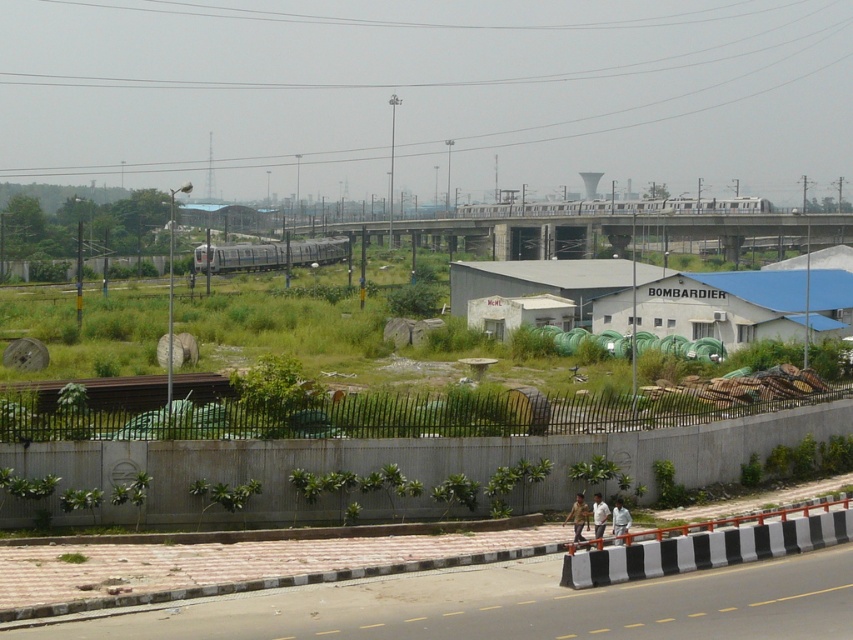
Consider the image. You are a delivery person carrying a package and need to cross from the brown metallic train track at lower center to the white fabric shirt at lower right. Given that the minimum safe distance required for crossing is 10 meters, can you safely make this crossing?

Result: The distance between the brown metallic train track at lower center and the white fabric shirt at lower right is 10.99 meters, which exceeds the minimum safe distance of 10 meters. Therefore, you can safely cross from the brown metallic train track at lower center to the white fabric shirt at lower right.